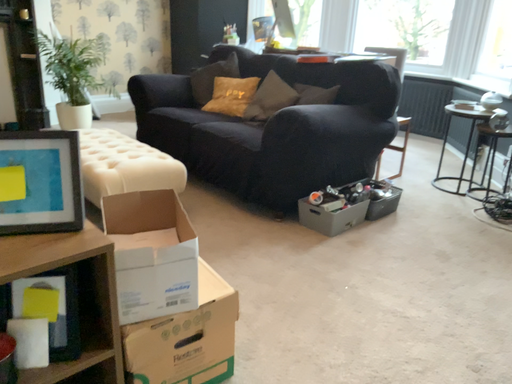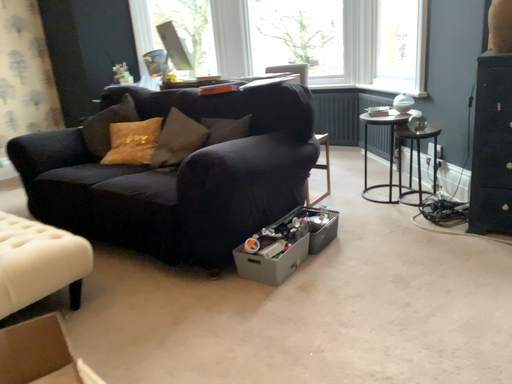
Question: How did the camera likely rotate when shooting the video?

Choices:
 (A) rotated right
 (B) rotated left

Answer: (A)